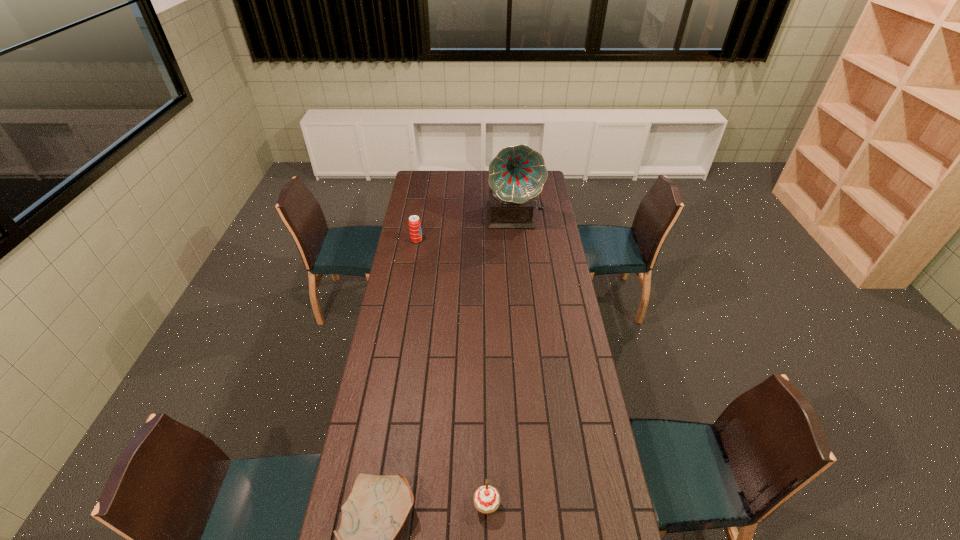
Identify which object is the second nearest to the shortest object. Please provide its 2D coordinates. Your answer should be formatted as a tuple, i.e. [(x, y)], where the tuple contains the x and y coordinates of a point satisfying the conditions above.

[(414, 222)]

Where is `the third closest object to the pottery`? the third closest object to the pottery is located at coordinates pos(517,174).